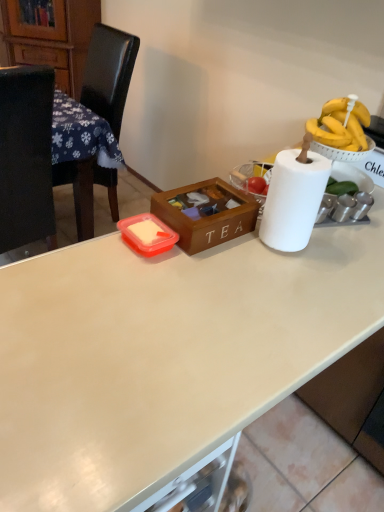
You are a GUI agent. You are given a task and a screenshot of the screen. Output one action in this format:
    pyautogui.click(x=<x>, y=<y>)
    Task: Click on the free space in front of wooden tea box at center
    The image size is (384, 512).
    Given the screenshot: What is the action you would take?
    pyautogui.click(x=200, y=273)